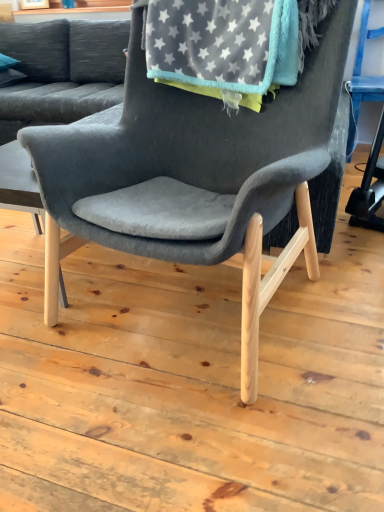
Question: From the image's perspective, does velvet gray couch at upper left appear higher than light wood table at center?

Choices:
 (A) no
 (B) yes

Answer: (B)

Question: From a real-world perspective, is velvet gray couch at upper left positioned under light wood table at center based on gravity?

Choices:
 (A) yes
 (B) no

Answer: (B)

Question: Is the depth of velvet gray couch at upper left less than that of light wood table at center?

Choices:
 (A) no
 (B) yes

Answer: (A)

Question: Is velvet gray couch at upper left shorter than light wood table at center?

Choices:
 (A) no
 (B) yes

Answer: (A)

Question: Is velvet gray couch at upper left turned away from light wood table at center?

Choices:
 (A) yes
 (B) no

Answer: (B)

Question: Considering the relative sizes of velvet gray couch at upper left and light wood table at center in the image provided, is velvet gray couch at upper left bigger than light wood table at center?

Choices:
 (A) no
 (B) yes

Answer: (B)

Question: Can you confirm if velvet gray couch at upper left is positioned to the right of velvet gray chair at center?

Choices:
 (A) no
 (B) yes

Answer: (A)

Question: Does velvet gray couch at upper left appear on the left side of velvet gray chair at center?

Choices:
 (A) yes
 (B) no

Answer: (A)

Question: From a real-world perspective, is velvet gray couch at upper left positioned over velvet gray chair at center based on gravity?

Choices:
 (A) no
 (B) yes

Answer: (B)

Question: Can you confirm if velvet gray couch at upper left is taller than velvet gray chair at center?

Choices:
 (A) yes
 (B) no

Answer: (B)

Question: Does velvet gray couch at upper left come in front of velvet gray chair at center?

Choices:
 (A) no
 (B) yes

Answer: (A)

Question: Is velvet gray couch at upper left smaller than velvet gray chair at center?

Choices:
 (A) no
 (B) yes

Answer: (A)

Question: Is velvet gray chair at center aimed at gray fleece blanket at upper center?

Choices:
 (A) yes
 (B) no

Answer: (B)